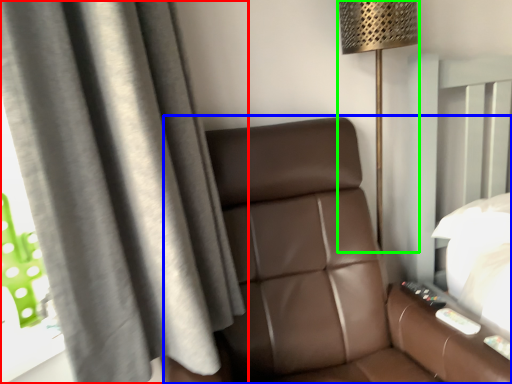
Question: Estimate the real-world distances between objects in this image. Which object is farther from curtain (highlighted by a red box), furniture (highlighted by a blue box) or lamp (highlighted by a green box)?

Choices:
 (A) furniture
 (B) lamp

Answer: (B)